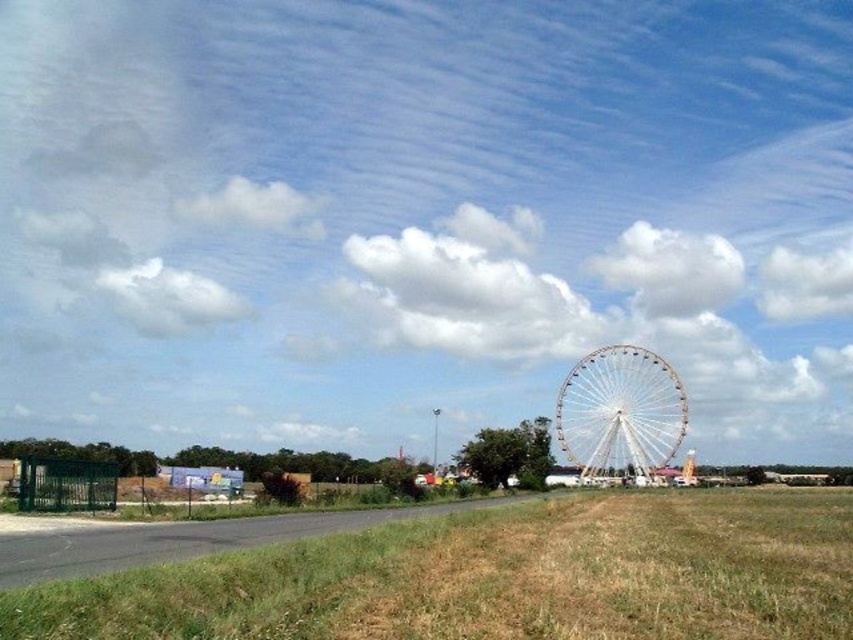
Question: Which point appears closest to the camera in this image?

Choices:
 (A) (666, 582)
 (B) (608, 403)

Answer: (A)

Question: Is dry grass at lower center thinner than white metallic ferris wheel at center?

Choices:
 (A) no
 (B) yes

Answer: (A)

Question: Can you confirm if dry grass at lower center is positioned to the left of white metallic ferris wheel at center?

Choices:
 (A) yes
 (B) no

Answer: (A)

Question: Is dry grass at lower center thinner than white metallic ferris wheel at center?

Choices:
 (A) yes
 (B) no

Answer: (B)